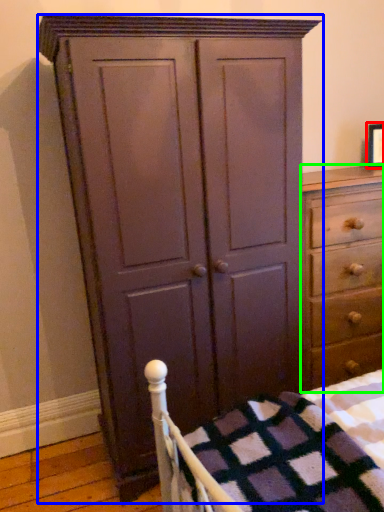
Question: Estimate the real-world distances between objects in this image. Which object is closer to picture frame (highlighted by a red box), cupboard (highlighted by a blue box) or chest of drawers (highlighted by a green box)?

Choices:
 (A) cupboard
 (B) chest of drawers

Answer: (B)